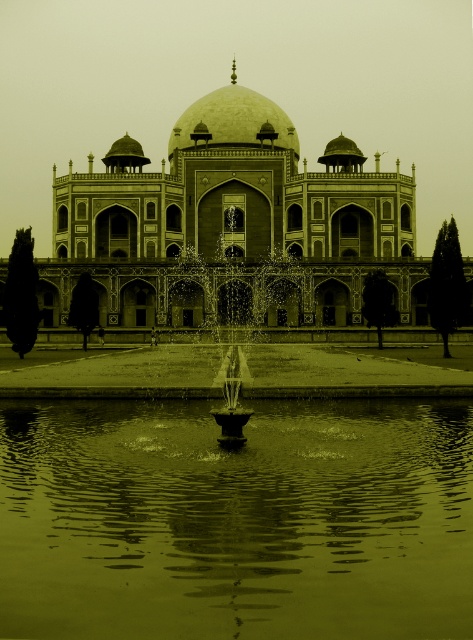
Which is above, sepia stone palace at center or smooth stone fountain at center?

Positioned higher is sepia stone palace at center.

Does sepia stone palace at center appear on the left side of smooth stone fountain at center?

In fact, sepia stone palace at center is to the right of smooth stone fountain at center.

Measure the distance between sepia stone palace at center and camera.

sepia stone palace at center and camera are 310.87 feet apart.

At what (x,y) coordinates should I click in order to perform the action: click on sepia stone palace at center. Please return your answer as a coordinate pair (x, y). Looking at the image, I should click on (230, 221).

Between green reflective water at center and sepia stone palace at center, which one is positioned higher?

Positioned higher is sepia stone palace at center.

Between green reflective water at center and sepia stone palace at center, which one appears on the left side from the viewer's perspective?

green reflective water at center is more to the left.

You are a GUI agent. You are given a task and a screenshot of the screen. Output one action in this format:
    pyautogui.click(x=<x>, y=<y>)
    Task: Click on the green reflective water at center
    
    Given the screenshot: What is the action you would take?
    pyautogui.click(x=236, y=520)

The height and width of the screenshot is (640, 473). What are the coordinates of `green reflective water at center` in the screenshot? It's located at (236, 520).

Is green reflective water at center closer to the viewer compared to smooth stone fountain at center?

Yes, green reflective water at center is in front of smooth stone fountain at center.

What do you see at coordinates (236, 520) in the screenshot? This screenshot has height=640, width=473. I see `green reflective water at center` at bounding box center [236, 520].

What do you see at coordinates (236, 520) in the screenshot? The height and width of the screenshot is (640, 473). I see `green reflective water at center` at bounding box center [236, 520].

Image resolution: width=473 pixels, height=640 pixels. Identify the location of green reflective water at center. point(236,520).